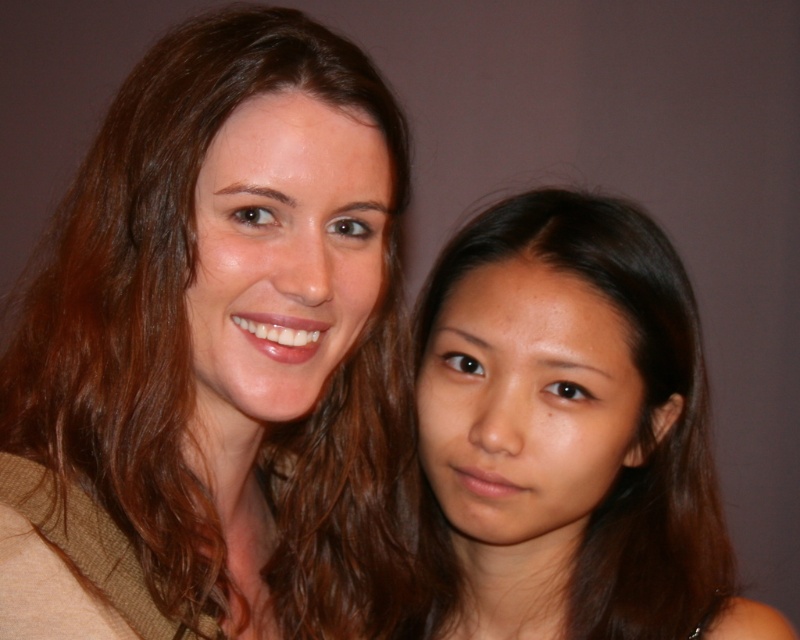
Can you confirm if brown hair at center is smaller than smooth brown hair at center?

Actually, brown hair at center might be larger than smooth brown hair at center.

Can you confirm if brown hair at center is positioned below smooth brown hair at center?

No, brown hair at center is not below smooth brown hair at center.

Is point (276, 316) closer to viewer compared to point (552, 600)?

Yes, it is in front of point (552, 600).

Where is `brown hair at center`? brown hair at center is located at coordinates (214, 353).